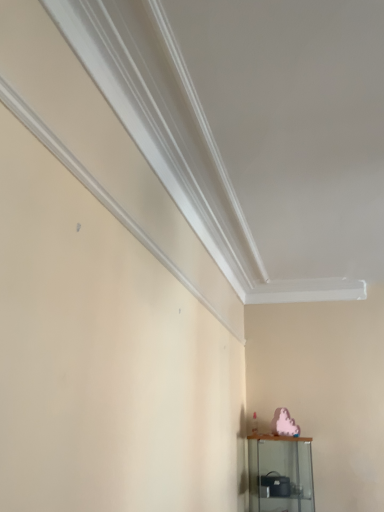
Question: Does clear glass shelf at lower right have a lesser height compared to pink matte ghost at lower right?

Choices:
 (A) no
 (B) yes

Answer: (A)

Question: From the image's perspective, does clear glass shelf at lower right appear lower than pink matte ghost at lower right?

Choices:
 (A) yes
 (B) no

Answer: (A)

Question: Is the depth of clear glass shelf at lower right less than that of pink matte ghost at lower right?

Choices:
 (A) yes
 (B) no

Answer: (A)

Question: Considering the relative sizes of clear glass shelf at lower right and pink matte ghost at lower right in the image provided, is clear glass shelf at lower right smaller than pink matte ghost at lower right?

Choices:
 (A) yes
 (B) no

Answer: (B)

Question: Is clear glass shelf at lower right beside pink matte ghost at lower right?

Choices:
 (A) yes
 (B) no

Answer: (B)

Question: From the image's perspective, is clear glass shelf at lower right on pink matte ghost at lower right?

Choices:
 (A) yes
 (B) no

Answer: (B)

Question: Does pink matte ghost at lower right appear on the right side of clear glass shelf at lower right?

Choices:
 (A) no
 (B) yes

Answer: (B)

Question: Could you tell me if pink matte ghost at lower right is turned towards clear glass shelf at lower right?

Choices:
 (A) no
 (B) yes

Answer: (A)

Question: Is pink matte ghost at lower right at the left side of clear glass shelf at lower right?

Choices:
 (A) yes
 (B) no

Answer: (B)

Question: Is pink matte ghost at lower right in front of clear glass shelf at lower right?

Choices:
 (A) yes
 (B) no

Answer: (B)

Question: From a real-world perspective, is pink matte ghost at lower right physically above clear glass shelf at lower right?

Choices:
 (A) yes
 (B) no

Answer: (A)

Question: Is pink matte ghost at lower right in contact with clear glass shelf at lower right?

Choices:
 (A) yes
 (B) no

Answer: (B)

Question: Is pink matte ghost at lower right wider or thinner than clear glass shelf at lower right?

Choices:
 (A) wide
 (B) thin

Answer: (B)